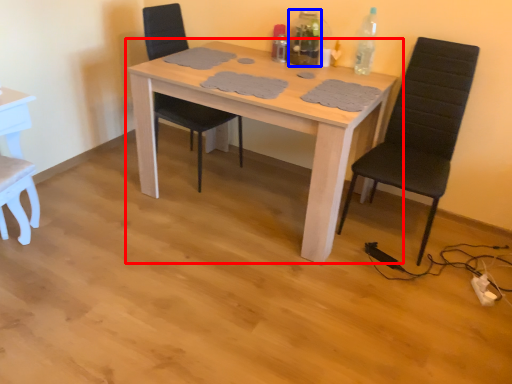
Question: Which object appears farthest to the camera in this image, table (highlighted by a red box) or bottle (highlighted by a blue box)?

Choices:
 (A) table
 (B) bottle

Answer: (B)